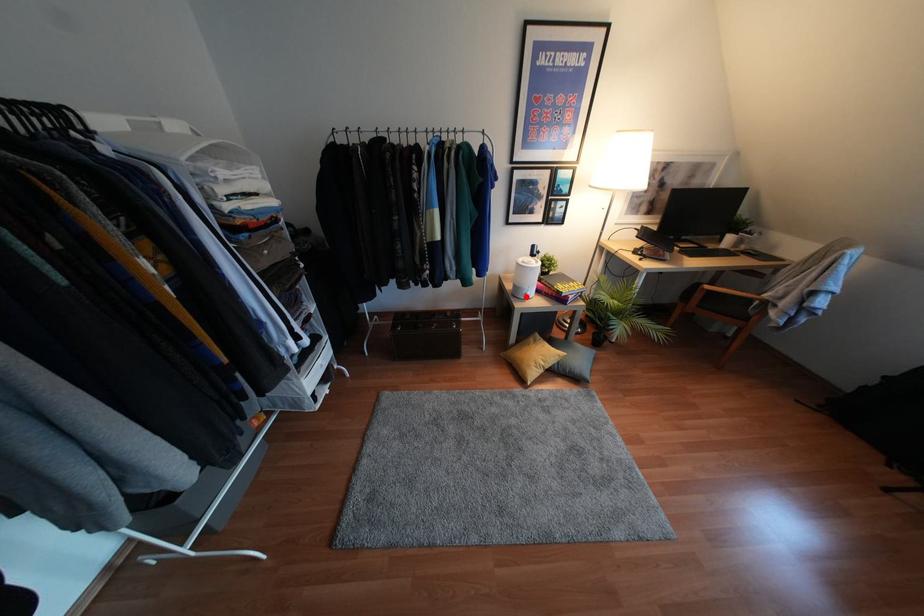
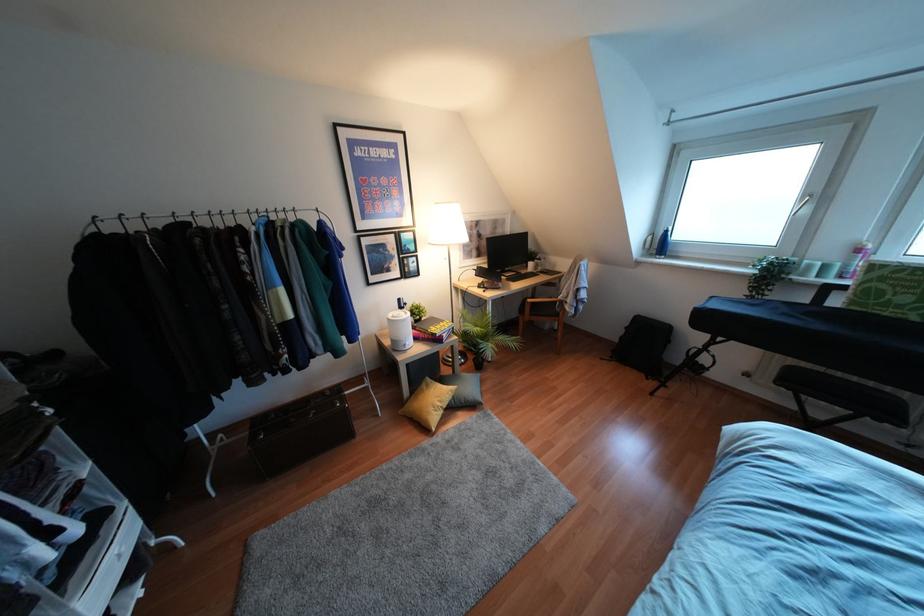
Question: I am providing you with two images of the same scene from different viewpoints. Image1 has a red point marked. In image2, the corresponding 3D location appears at what relative position? Reply with the corresponding letter.

Choices:
 (A) Closer
 (B) Farther

Answer: (B)